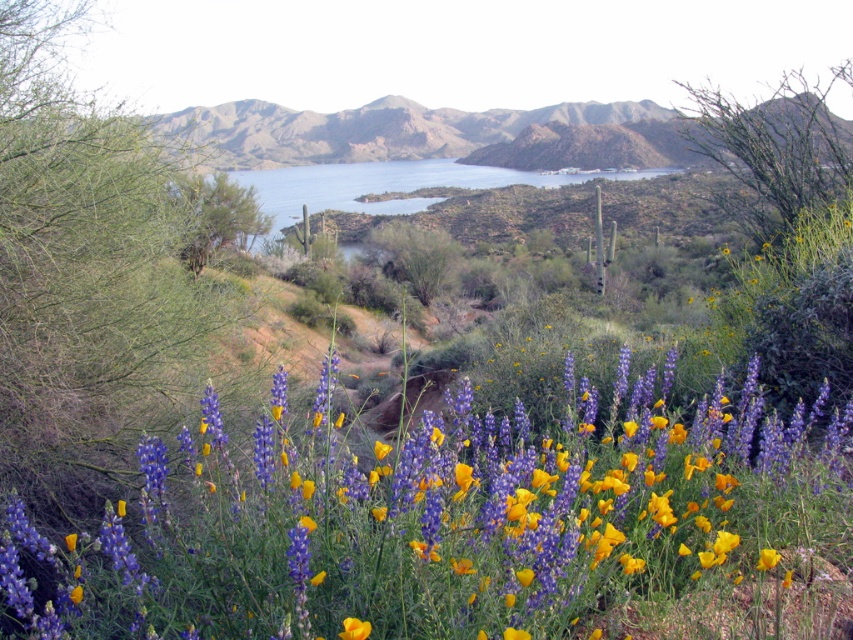
Question: Can you confirm if vibrant purple petals at center is positioned below yellow matte flower at lower center?

Choices:
 (A) no
 (B) yes

Answer: (A)

Question: Which object appears farthest from the camera in this image?

Choices:
 (A) vibrant purple petals at center
 (B) yellow matte flower at lower center

Answer: (B)

Question: Does vibrant purple petals at center have a greater width compared to yellow matte flower at lower center?

Choices:
 (A) no
 (B) yes

Answer: (B)

Question: Which object is positioned farthest from the blue water at center?

Choices:
 (A) vibrant purple petals at center
 (B) yellow matte flower at lower center

Answer: (B)

Question: Which point is farther to the camera?

Choices:
 (A) (402, 180)
 (B) (343, 618)

Answer: (A)

Question: Is vibrant purple petals at center further to the viewer compared to yellow matte flower at lower center?

Choices:
 (A) yes
 (B) no

Answer: (B)